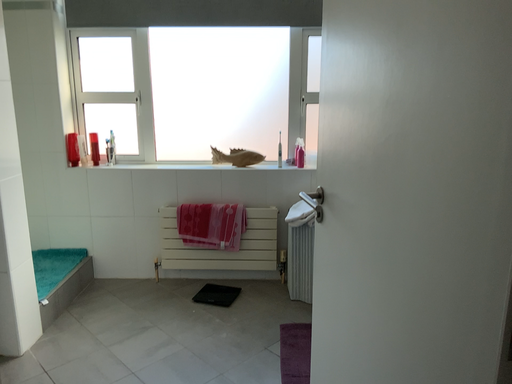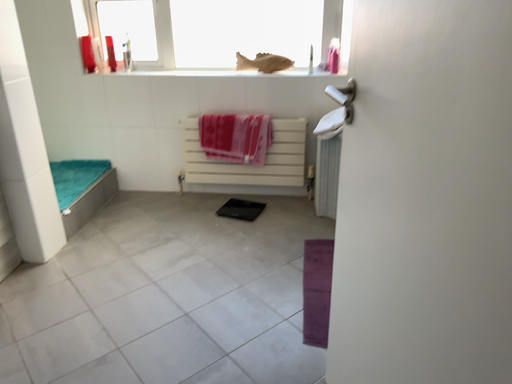
Question: Which way did the camera rotate in the video?

Choices:
 (A) rotated downward
 (B) rotated upward

Answer: (A)